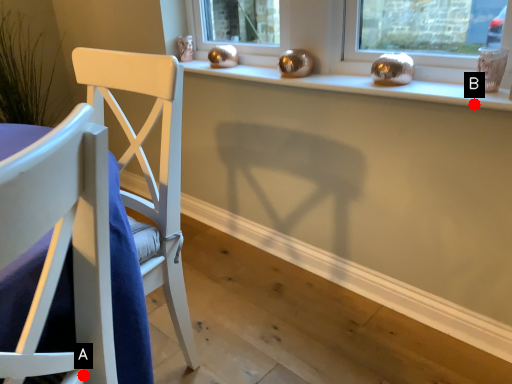
Question: Two points are circled on the image, labeled by A and B beside each circle. Which point is closer to the camera?

Choices:
 (A) A is closer
 (B) B is closer

Answer: (A)